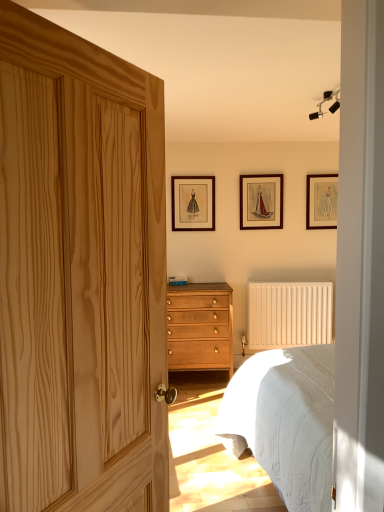
At what (x,y) coordinates should I click in order to perform the action: click on natural wood door at left. Please return your answer as a coordinate pair (x, y). The height and width of the screenshot is (512, 384). Looking at the image, I should click on (80, 274).

Measure the distance between wooden picture frame at center, the second picture frame when ordered from left to right, and camera.

wooden picture frame at center, the second picture frame when ordered from left to right, is 4.26 meters from camera.

Describe the element at coordinates (321, 201) in the screenshot. I see `wooden picture frame at upper right, placed as the 3th picture frame when sorted from left to right` at that location.

This screenshot has width=384, height=512. What do you see at coordinates (327, 101) in the screenshot? I see `black matte track lights at upper right` at bounding box center [327, 101].

Where is `white textured bed at lower right`? white textured bed at lower right is located at coordinates (285, 420).

Which of these two, natural wood door at left or black matte track lights at upper right, stands taller?

Standing taller between the two is natural wood door at left.

Measure the distance between natural wood door at left and black matte track lights at upper right.

6.32 feet.

From the image's perspective, is natural wood door at left above or below black matte track lights at upper right?

Based on their image positions, natural wood door at left is located beneath black matte track lights at upper right.

Find the location of a particular element. The image size is (384, 512). door below the black matte track lights at upper right (from the image's perspective) is located at coordinates (80, 274).

How much distance is there between light brown wood chest of drawers at center and beige textured radiator at lower right?

The distance of light brown wood chest of drawers at center from beige textured radiator at lower right is 26.25 inches.

From the image's perspective, between light brown wood chest of drawers at center and beige textured radiator at lower right, which one is located above?

beige textured radiator at lower right appears higher in the image.

Considering the points (227, 367) and (265, 285), which point is behind, point (227, 367) or point (265, 285)?

The point (265, 285) is behind.

Can you tell me how much light brown wood chest of drawers at center and white textured bed at lower right differ in facing direction?

86.1 degrees.

Is light brown wood chest of drawers at center wider than white textured bed at lower right?

Incorrect, the width of light brown wood chest of drawers at center does not surpass that of white textured bed at lower right.

Does light brown wood chest of drawers at center touch white textured bed at lower right?

light brown wood chest of drawers at center and white textured bed at lower right are not in contact.

This screenshot has height=512, width=384. What are the coordinates of `chest of drawers above the white textured bed at lower right (from a real-world perspective)` in the screenshot? It's located at (200, 327).

In terms of size, does wooden picture frame at upper right, placed as the first picture frame when sorted from right to left, appear bigger or smaller than black matte track lights at upper right?

Considering their sizes, wooden picture frame at upper right, placed as the first picture frame when sorted from right to left, takes up more space than black matte track lights at upper right.

Is wooden picture frame at upper right, placed as the first picture frame when sorted from right to left, looking in the opposite direction of black matte track lights at upper right?

No, wooden picture frame at upper right, placed as the first picture frame when sorted from right to left,'s orientation is not away from black matte track lights at upper right.

From a real-world perspective, between wooden picture frame at upper right, placed as the 3th picture frame when sorted from left to right, and black matte track lights at upper right, who is vertically lower?

From a 3D spatial view, wooden picture frame at upper right, placed as the 3th picture frame when sorted from left to right, is below.

Considering their positions, is wooden picture frame at upper right, placed as the first picture frame when sorted from right to left, located in front of or behind black matte track lights at upper right?

Visually, wooden picture frame at upper right, placed as the first picture frame when sorted from right to left, is located behind black matte track lights at upper right.

From the image's perspective, is wooden picture frame at center, the second picture frame when ordered from left to right, on white textured bed at lower right?

Correct, wooden picture frame at center, the second picture frame when ordered from left to right, appears higher than white textured bed at lower right in the image.

Does point (250, 201) come in front of point (329, 408)?

No, it is not.

From the image's perspective, which picture frame is the 1st one above the white textured bed at lower right? Please provide its 2D coordinates.

[(261, 201)]

Could you measure the distance between beige textured radiator at lower right and light brown wood chest of drawers at center?

They are 66.67 centimeters apart.

Considering the positions of objects beige textured radiator at lower right and light brown wood chest of drawers at center in the image provided, who is more to the right, beige textured radiator at lower right or light brown wood chest of drawers at center?

From the viewer's perspective, beige textured radiator at lower right appears more on the right side.

Between point (256, 317) and point (186, 344), which one is positioned behind?

Point (256, 317)

Between white textured bed at lower right and beige textured radiator at lower right, which one has smaller size?

beige textured radiator at lower right is smaller.

Identify the location of bed below the beige textured radiator at lower right (from a real-world perspective). This screenshot has width=384, height=512. (285, 420).

From the image's perspective, would you say white textured bed at lower right is positioned over beige textured radiator at lower right?

No, from the image's perspective, white textured bed at lower right is not over beige textured radiator at lower right.

You are a GUI agent. You are given a task and a screenshot of the screen. Output one action in this format:
    pyautogui.click(x=<x>, y=<y>)
    Task: Click on the light fixture behind the natural wood door at left
    The height and width of the screenshot is (512, 384).
    Given the screenshot: What is the action you would take?
    pyautogui.click(x=327, y=101)

Identify the location of radiator above the light brown wood chest of drawers at center (from a real-world perspective). The image size is (384, 512). tap(289, 314).

Considering their positions, is light brown wood chest of drawers at center positioned closer to white textured bed at lower right than natural wood door at left?

Based on the image, natural wood door at left appears to be nearer to white textured bed at lower right.

Which object lies further to the anchor point black matte track lights at upper right, natural wood door at left or wooden picture frame at center, the second picture frame when ordered from left to right?

natural wood door at left is positioned further to the anchor black matte track lights at upper right.

Considering their positions, is beige textured radiator at lower right positioned further to wooden picture frame at center, which is the second picture frame in right-to-left order, than light brown wood chest of drawers at center?

The object further to wooden picture frame at center, which is the second picture frame in right-to-left order, is light brown wood chest of drawers at center.

Based on their spatial positions, is beige textured radiator at lower right or natural wood door at left closer to white textured bed at lower right?

natural wood door at left is positioned closer to the anchor white textured bed at lower right.

Estimate the real-world distances between objects in this image. Which object is further from wooden picture frame at upper right, placed as the 3th picture frame when sorted from left to right, wooden picture frame at center, the second picture frame when ordered from left to right, or black matte track lights at upper right?

black matte track lights at upper right is further to wooden picture frame at upper right, placed as the 3th picture frame when sorted from left to right.

Estimate the real-world distances between objects in this image. Which object is further from wooden picture frame at upper right, placed as the first picture frame when sorted from right to left, black matte track lights at upper right or white textured bed at lower right?

white textured bed at lower right is positioned further to the anchor wooden picture frame at upper right, placed as the first picture frame when sorted from right to left.

Which object lies further to the anchor point white textured bed at lower right, natural wood door at left or light brown wood chest of drawers at center?

The object further to white textured bed at lower right is light brown wood chest of drawers at center.

Estimate the real-world distances between objects in this image. Which object is further from beige textured radiator at lower right, wooden picture frame at center, the second picture frame when ordered from left to right, or light brown wood chest of drawers at center?

Among the two, wooden picture frame at center, the second picture frame when ordered from left to right, is located further to beige textured radiator at lower right.

This screenshot has height=512, width=384. Identify the location of bed between natural wood door at left and wooden picture frame at upper right, placed as the 3th picture frame when sorted from left to right, in the front-back direction. (285, 420).

Where is `chest of drawers between natural wood door at left and beige textured radiator at lower right along the z-axis`? The image size is (384, 512). chest of drawers between natural wood door at left and beige textured radiator at lower right along the z-axis is located at coordinates (200, 327).

Locate an element on the screen. bed between natural wood door at left and light brown wood chest of drawers at center from front to back is located at coordinates (285, 420).

Locate an element on the screen. This screenshot has width=384, height=512. light fixture between natural wood door at left and wooden picture frame at center, which is the second picture frame in right-to-left order, from front to back is located at coordinates (327, 101).